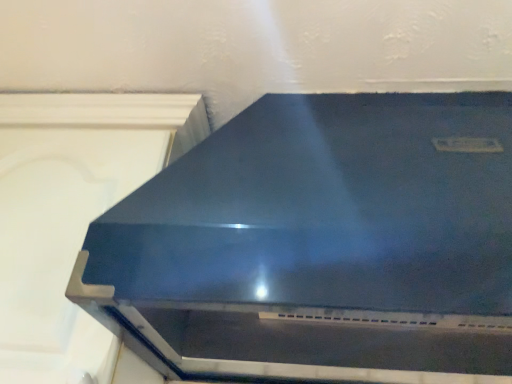
The height and width of the screenshot is (384, 512). What do you see at coordinates (320, 245) in the screenshot?
I see `satin blue oven at center` at bounding box center [320, 245].

Locate an element on the screen. satin blue oven at center is located at coordinates (320, 245).

At what (x,y) coordinates should I click in order to perform the action: click on satin blue oven at center. Please return your answer as a coordinate pair (x, y). The height and width of the screenshot is (384, 512). Looking at the image, I should click on (320, 245).